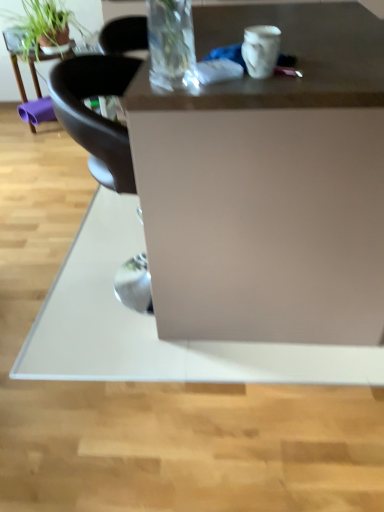
I want to click on free space on the front side of matte black table at upper left, so click(38, 148).